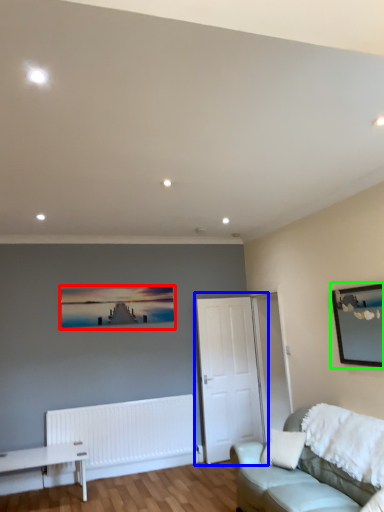
Question: Which object is positioned closest to picture frame (highlighted by a red box)? Select from door (highlighted by a blue box) and picture frame (highlighted by a green box).

Choices:
 (A) door
 (B) picture frame

Answer: (A)